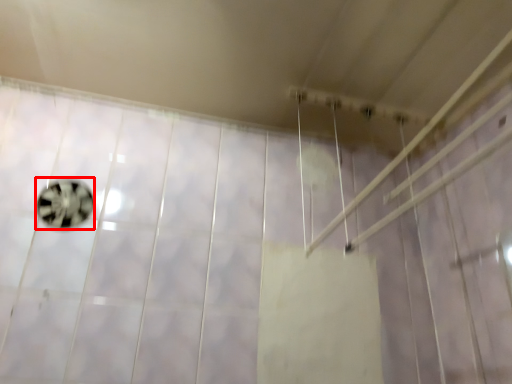
Question: From the image's perspective, what is the correct spatial relationship of ball (annotated by the red box) in relation to shower?

Choices:
 (A) below
 (B) above

Answer: (A)